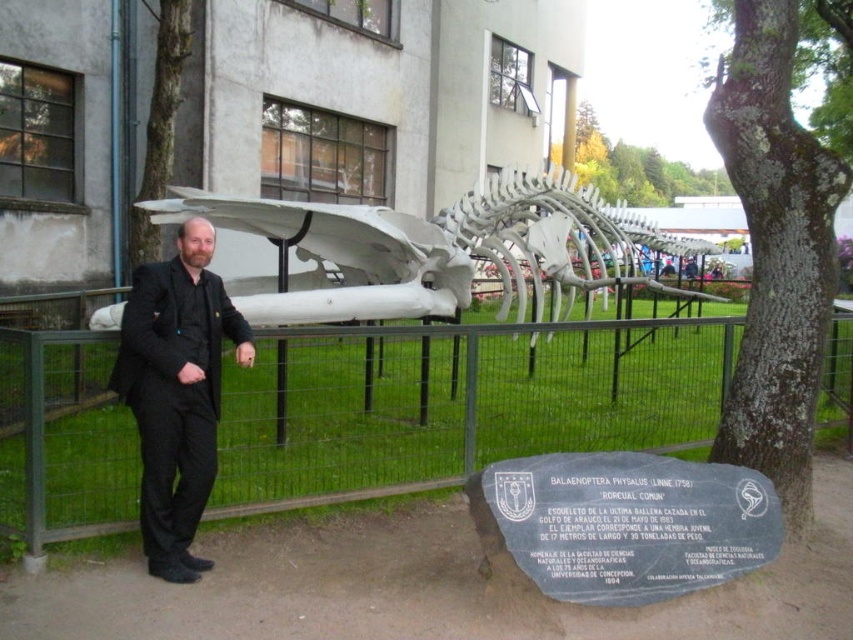
You are a visitor at the museum and want to take a photo of the white metallic whale skeleton at center without the black fabric suit at left appearing in the frame. Is this possible based on their positions?

The white metallic whale skeleton at center is further to the viewer than the black fabric suit at left, so you can position yourself so that the whale skeleton blocks the view of the suit, making it possible to take a photo without the suit appearing in the frame.

You are a visitor at the museum and want to take a photo of the metal wire fence at center and the white metallic whale skeleton at center. Which object is taller so that you can adjust your camera angle accordingly?

The white metallic whale skeleton at center is taller than the metal wire fence at center, so you should adjust your camera angle to capture its full height.